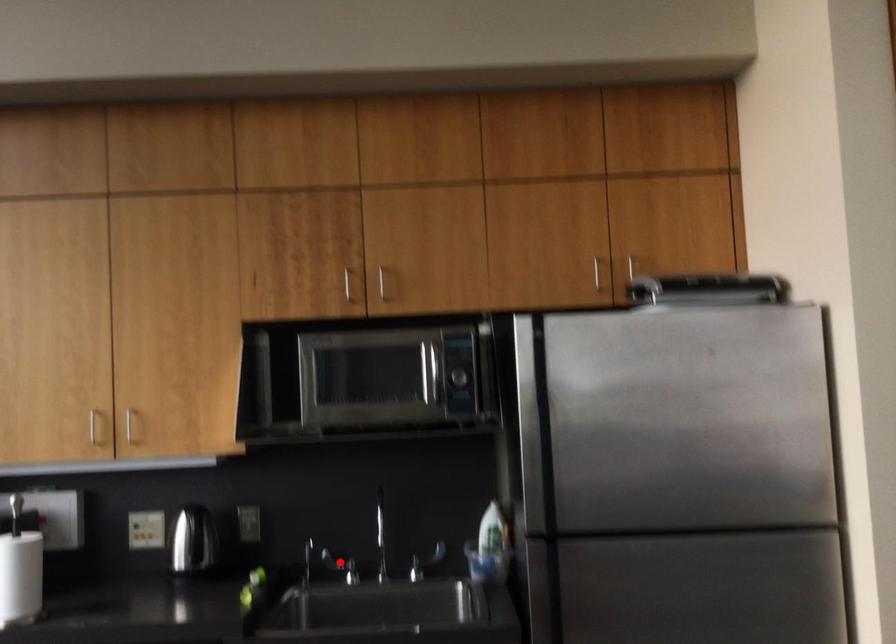
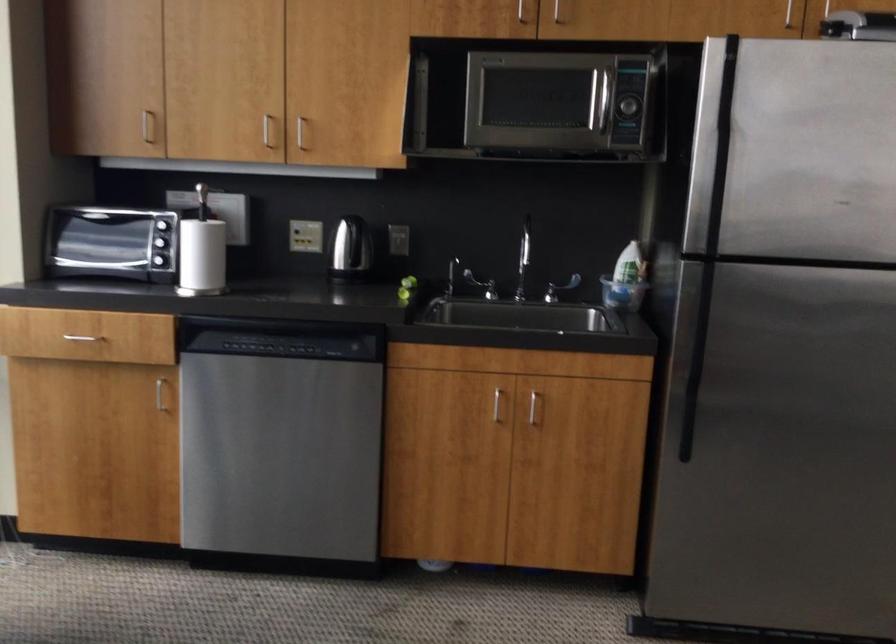
Find the pixel in the second image that matches the highlighted location in the first image.

(480, 285)